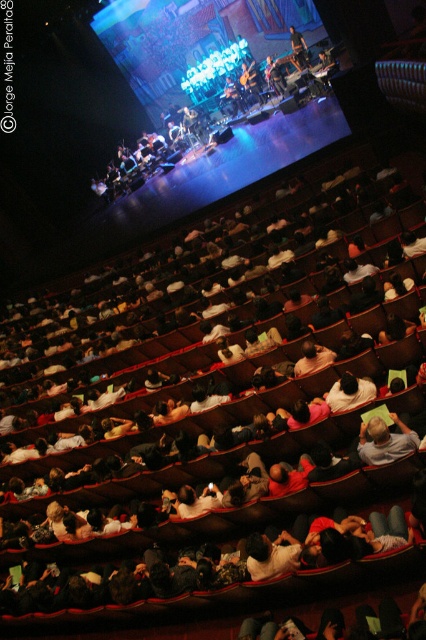
You are sitting in the auditorium and want to know where your seat is located relative to the stage. The seat you are sitting on is the dark gray fabric seat at center. Based on the scene description, can you determine if your seat is closer to the front or the back of the auditorium?

The dark gray fabric seat at center is located at point 0.720 on the x axis and 0.486 on the y axis. Since the x coordinate is closer to 1, which typically represents the back of the auditorium, your seat is closer to the back.

You are sitting in the dark gray fabric seat at center and want to throw a small snack to your friend wearing the light brown fabric shirt at lower right. Can you reach them without leaving your seat?

The dark gray fabric seat at center and the light brown fabric shirt at lower right are 2.04 meters apart from each other. Since the distance is within a typical throwing range, you can likely reach them without leaving your seat.